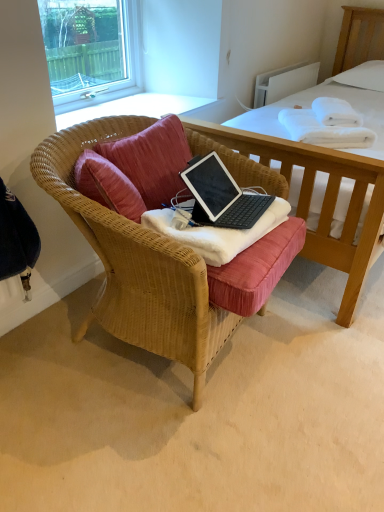
Locate an element on the screen. white soft blanket at center, positioned as the 2th blanket in top-to-bottom order is located at coordinates (215, 232).

At what (x,y) coordinates should I click in order to perform the action: click on white cotton bed at center. Please return your answer as a coordinate pair (x, y). Looking at the image, I should click on (323, 201).

Find the location of `black matte laptop at center`. black matte laptop at center is located at coordinates (221, 195).

Describe the element at coordinates (221, 195) in the screenshot. Image resolution: width=384 pixels, height=512 pixels. I see `black matte laptop at center` at that location.

The image size is (384, 512). What do you see at coordinates (327, 124) in the screenshot? I see `white soft towel at upper right, positioned as the second blanket in bottom-to-top order` at bounding box center [327, 124].

Describe the element at coordinates (90, 48) in the screenshot. The height and width of the screenshot is (512, 384). I see `clear glass window at upper left` at that location.

Identify the location of pink fabric pillow at center. (152, 160).

In the scene shown: Which of these two, white cotton bed at center or woven wood chair at center, is wider?

Wider between the two is white cotton bed at center.

From a real-world perspective, is white cotton bed at center positioned under woven wood chair at center based on gravity?

No, from a real-world perspective, white cotton bed at center is not beneath woven wood chair at center.

Can you confirm if white cotton bed at center is shorter than woven wood chair at center?

Incorrect, the height of white cotton bed at center does not fall short of that of woven wood chair at center.

Based on their positions, is white cotton bed at center located to the left or right of woven wood chair at center?

white cotton bed at center is positioned on woven wood chair at center's right side.

Is pink fabric pillow at center not within clear glass window at upper left?

Absolutely, pink fabric pillow at center is external to clear glass window at upper left.

Considering the positions of objects pink fabric pillow at center and clear glass window at upper left in the image provided, who is behind, pink fabric pillow at center or clear glass window at upper left?

Positioned behind is clear glass window at upper left.

Could you tell me if pink fabric pillow at center is facing clear glass window at upper left?

No, pink fabric pillow at center does not turn towards clear glass window at upper left.

Where is `pillow below the clear glass window at upper left (from the image's perspective)`? pillow below the clear glass window at upper left (from the image's perspective) is located at coordinates (152, 160).

Can we say pink fabric pillow at center lies outside white soft towel at upper right, which ranks as the 2th blanket in front-to-back order?

That's correct, pink fabric pillow at center is outside of white soft towel at upper right, which ranks as the 2th blanket in front-to-back order.

Is pink fabric pillow at center turned away from white soft towel at upper right, the 1th blanket when ordered from right to left?

No, white soft towel at upper right, the 1th blanket when ordered from right to left, is not at the back of pink fabric pillow at center.

Is pink fabric pillow at center taller or shorter than white soft towel at upper right, the 1th blanket positioned from the back?

Clearly, pink fabric pillow at center is taller compared to white soft towel at upper right, the 1th blanket positioned from the back.

From a real-world perspective, is pink fabric pillow at center on white soft towel at upper right, which ranks as the 2th blanket in front-to-back order?

Yes.

Are clear glass window at upper left and white soft towel at upper right, which is the 2th blanket from left to right, making contact?

No, clear glass window at upper left is not with white soft towel at upper right, which is the 2th blanket from left to right.

Is point (114, 8) closer or farther from the camera than point (289, 121)?

Point (114, 8).

Identify the location of the 2nd blanket to the right of the clear glass window at upper left, counting from the anchor's position. Image resolution: width=384 pixels, height=512 pixels. (327, 124).

Visually, is white soft towels at upper right positioned to the left or to the right of woven wood chair at center?

white soft towels at upper right is to the right of woven wood chair at center.

Based on the photo, from a real-world perspective, is white soft towels at upper right physically located above or below woven wood chair at center?

Clearly, from a real-world perspective, white soft towels at upper right is above woven wood chair at center.

From the image's perspective, does white soft towels at upper right appear lower than woven wood chair at center?

No, from the image's perspective, white soft towels at upper right is not beneath woven wood chair at center.

Is point (328, 123) positioned behind point (198, 289)?

That is True.

Is white cotton bed at center facing towards clear glass window at upper left?

No, white cotton bed at center is not facing towards clear glass window at upper left.

From a real-world perspective, which object rests below the other?

white cotton bed at center.

Is white cotton bed at center placed right next to clear glass window at upper left?

No, white cotton bed at center is not in contact with clear glass window at upper left.

Considering the positions of points (343, 307) and (52, 18), is point (343, 307) farther from camera compared to point (52, 18)?

No.

Between white soft blanket at center, which ranks as the first blanket in front-to-back order, and white cotton bed at center, which one appears on the right side from the viewer's perspective?

white cotton bed at center is more to the right.

Can you confirm if white soft blanket at center, positioned as the 2th blanket in top-to-bottom order, is wider than white cotton bed at center?

In fact, white soft blanket at center, positioned as the 2th blanket in top-to-bottom order, might be narrower than white cotton bed at center.

This screenshot has width=384, height=512. I want to click on chair in front of the white cotton bed at center, so click(x=136, y=263).

At what (x,y) coordinates should I click in order to perform the action: click on window screen positioned vertically above the pink fabric pillow at center (from a real-world perspective). Please return your answer as a coordinate pair (x, y). Looking at the image, I should click on (90, 48).

Considering their positions, is white soft blanket at center, which ranks as the first blanket in front-to-back order, positioned closer to white cotton bed at center than black matte laptop at center?

The object closer to white cotton bed at center is black matte laptop at center.

Based on their spatial positions, is pink fabric pillow at center or woven wood chair at center further from white soft towel at upper right, which is the 2th blanket from left to right?

woven wood chair at center lies further to white soft towel at upper right, which is the 2th blanket from left to right, than the other object.

Consider the image. Which object lies further to the anchor point woven wood chair at center, white cotton bed at center or white soft blanket at center, which ranks as the first blanket in front-to-back order?

Based on the image, white cotton bed at center appears to be further to woven wood chair at center.

When comparing their distances from white soft blanket at center, which is counted as the second blanket, starting from the back, does white soft towel at upper right, the 1th blanket from the top, or white soft towels at upper right seem closer?

white soft towel at upper right, the 1th blanket from the top, lies closer to white soft blanket at center, which is counted as the second blanket, starting from the back, than the other object.

Looking at this image, considering their positions, is white soft blanket at center, which ranks as the first blanket in front-to-back order, positioned further to white soft towels at upper right than black matte laptop at center?

white soft blanket at center, which ranks as the first blanket in front-to-back order.

Considering their positions, is white soft blanket at center, the first blanket in the left-to-right sequence, positioned closer to black matte laptop at center than white soft towels at upper right?

white soft blanket at center, the first blanket in the left-to-right sequence, is closer to black matte laptop at center.

Which object lies nearer to the anchor point white soft towels at upper right, white cotton bed at center or woven wood chair at center?

white cotton bed at center.

From the image, which object appears to be farther from clear glass window at upper left, black matte laptop at center or white soft towels at upper right?

white soft towels at upper right.

The width and height of the screenshot is (384, 512). What are the coordinates of `laptop located between white cotton bed at center and white soft towels at upper right in the depth direction` in the screenshot? It's located at (221, 195).

The image size is (384, 512). What are the coordinates of `laptop between clear glass window at upper left and white soft blanket at center, which ranks as the first blanket in front-to-back order, in the up-down direction` in the screenshot? It's located at (221, 195).

Locate an element on the screen. The height and width of the screenshot is (512, 384). blanket between woven wood chair at center and black matte laptop at center in the front-back direction is located at coordinates (215, 232).

Find the location of a particular element. blanket between clear glass window at upper left and white soft towel at upper right, the 1th blanket positioned from the back is located at coordinates (215, 232).